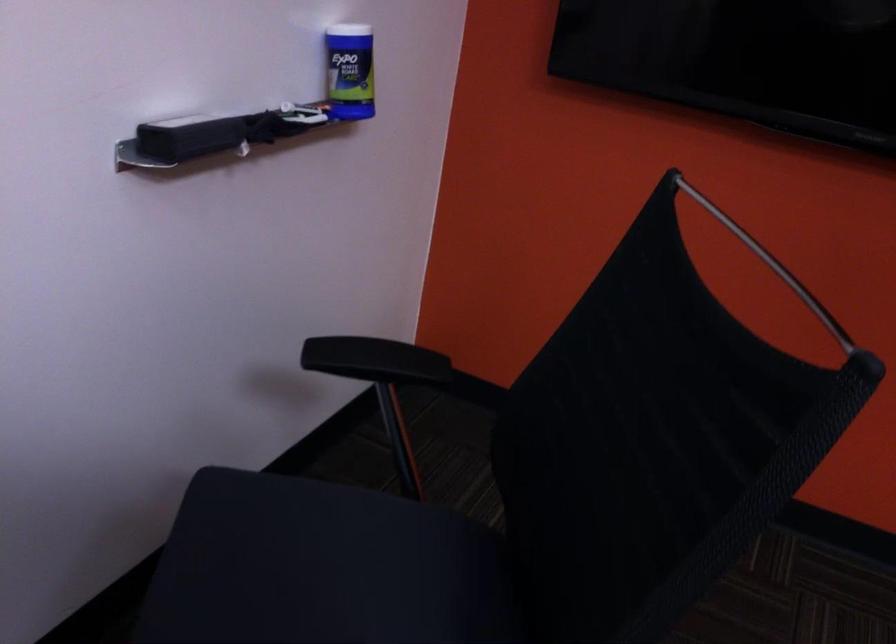
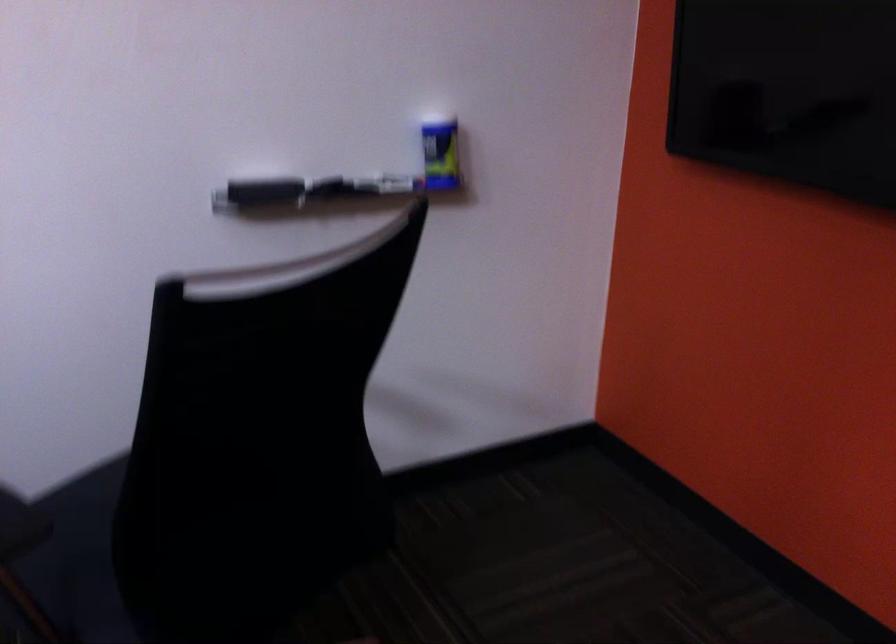
Where in the second image is the point corresponding to [264,117] from the first image?

(355, 181)